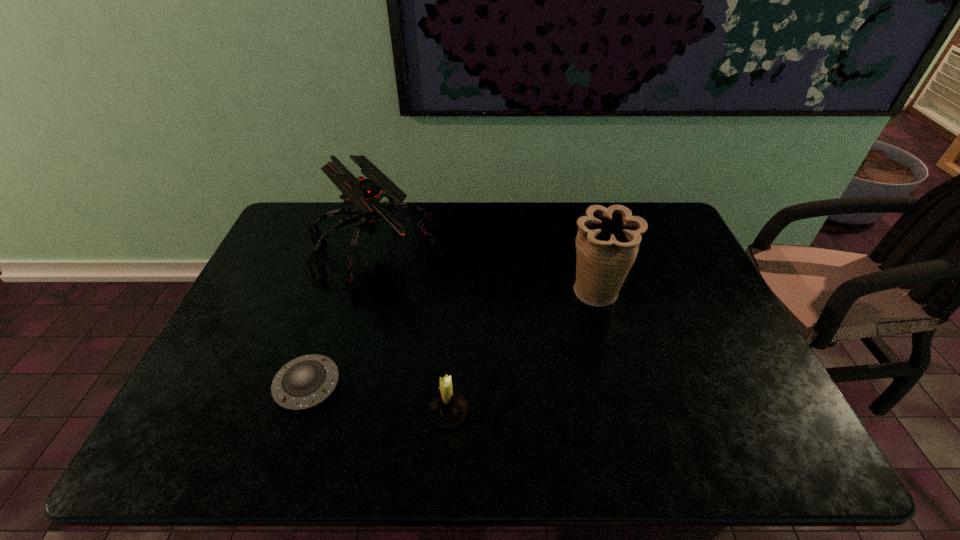
This screenshot has height=540, width=960. I want to click on free spot between the third object from left to right and the drone, so (412, 330).

Where is `empty location between the urn and the drone`? empty location between the urn and the drone is located at coordinates (486, 271).

In order to click on free area in between the third tallest object and the rightmost object in this screenshot , I will do `click(522, 353)`.

The height and width of the screenshot is (540, 960). I want to click on free point between the drone and the shortest object, so (342, 317).

You are a GUI agent. You are given a task and a screenshot of the screen. Output one action in this format:
    pyautogui.click(x=<x>, y=<y>)
    Task: Click on the free area in between the drone and the urn
    
    Given the screenshot: What is the action you would take?
    click(x=486, y=271)

This screenshot has height=540, width=960. I want to click on free space between the drone and the third object from left to right, so click(412, 330).

At what (x,y) coordinates should I click in order to perform the action: click on empty location between the shortest object and the drone. Please return your answer as a coordinate pair (x, y). Image resolution: width=960 pixels, height=540 pixels. Looking at the image, I should click on (342, 317).

Identify which object is located as the second nearest to the drone. Please provide its 2D coordinates. Your answer should be formatted as a tuple, i.e. [(x, y)], where the tuple contains the x and y coordinates of a point satisfying the conditions above.

[(448, 409)]

Where is `object that is the second closest to the rightmost object`? Image resolution: width=960 pixels, height=540 pixels. object that is the second closest to the rightmost object is located at coordinates (448, 409).

The image size is (960, 540). Find the location of `free space that satisfies the following two spatial constraints: 1. on the back side of the shortest object; 2. on the right side of the drone`. free space that satisfies the following two spatial constraints: 1. on the back side of the shortest object; 2. on the right side of the drone is located at coordinates (352, 248).